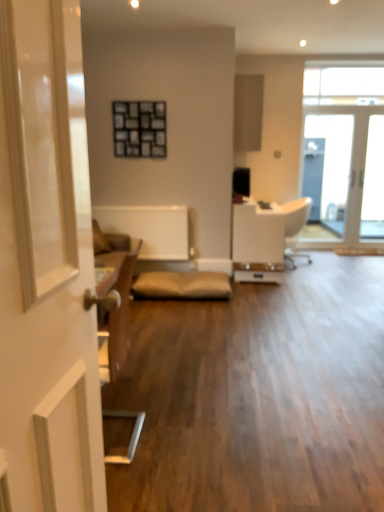
Question: Can you confirm if matte wood cabinet at upper center is smaller than white leather armchair at center?

Choices:
 (A) yes
 (B) no

Answer: (A)

Question: Is matte wood cabinet at upper center far away from white leather armchair at center?

Choices:
 (A) yes
 (B) no

Answer: (A)

Question: From the image's perspective, would you say matte wood cabinet at upper center is positioned over white leather armchair at center?

Choices:
 (A) no
 (B) yes

Answer: (B)

Question: Is matte wood cabinet at upper center shorter than white leather armchair at center?

Choices:
 (A) yes
 (B) no

Answer: (A)

Question: Can you confirm if matte wood cabinet at upper center is taller than white leather armchair at center?

Choices:
 (A) no
 (B) yes

Answer: (A)

Question: Would you say clear glass door at upper right, marked as the second window in a top-to-bottom arrangement, is inside or outside matte wood cabinet at upper center?

Choices:
 (A) inside
 (B) outside

Answer: (B)

Question: Considering the positions of point (331, 82) and point (243, 79), is point (331, 82) closer or farther from the camera than point (243, 79)?

Choices:
 (A) closer
 (B) farther

Answer: (B)

Question: In terms of height, does clear glass door at upper right, marked as the second window in a top-to-bottom arrangement, look taller or shorter compared to matte wood cabinet at upper center?

Choices:
 (A) tall
 (B) short

Answer: (A)

Question: Is clear glass door at upper right, which is the first window in bottom-to-top order, bigger or smaller than matte wood cabinet at upper center?

Choices:
 (A) big
 (B) small

Answer: (B)

Question: From the image's perspective, relative to matte wood cabinet at upper center, is white glossy door at left above or below?

Choices:
 (A) above
 (B) below

Answer: (B)

Question: Is point (69, 190) positioned closer to the camera than point (259, 95)?

Choices:
 (A) farther
 (B) closer

Answer: (B)

Question: From a real-world perspective, is white glossy door at left positioned above or below matte wood cabinet at upper center?

Choices:
 (A) above
 (B) below

Answer: (B)

Question: In terms of height, does white glossy door at left look taller or shorter compared to matte wood cabinet at upper center?

Choices:
 (A) short
 (B) tall

Answer: (B)

Question: Is white leather armchair at center wider or thinner than white glossy door at left?

Choices:
 (A) thin
 (B) wide

Answer: (B)

Question: Is point (274, 250) positioned closer to the camera than point (59, 459)?

Choices:
 (A) closer
 (B) farther

Answer: (B)